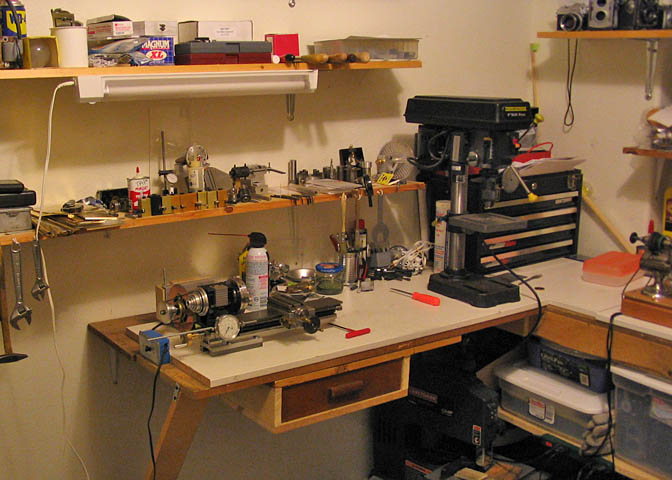
Locate an element on the screen. The height and width of the screenshot is (480, 672). plastic bins is located at coordinates (533, 410), (652, 428).